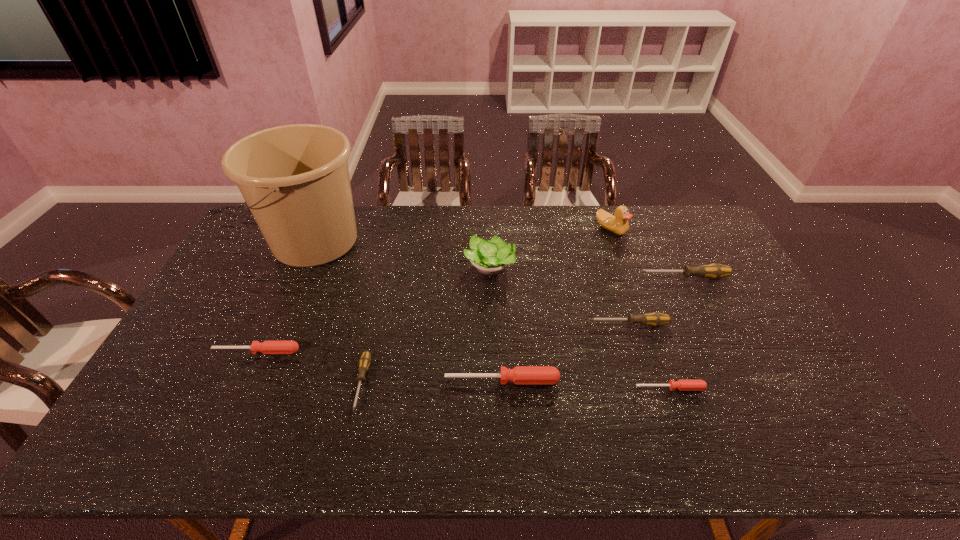
I want to click on free space that satisfies the following two spatial constraints: 1. at the tip of the second smallest gray screwdriver; 2. at the tip of the second screwdriver from left to right, so click(x=648, y=383).